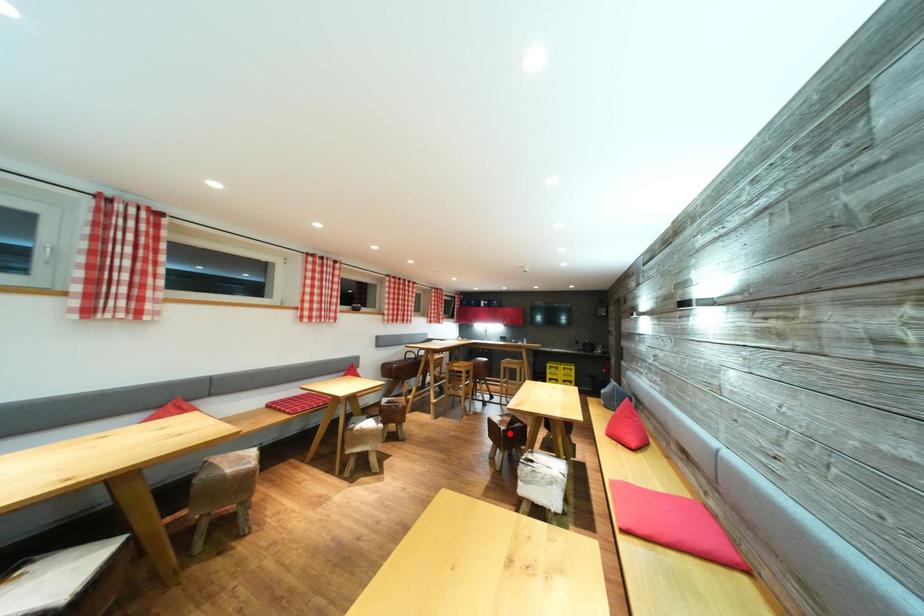
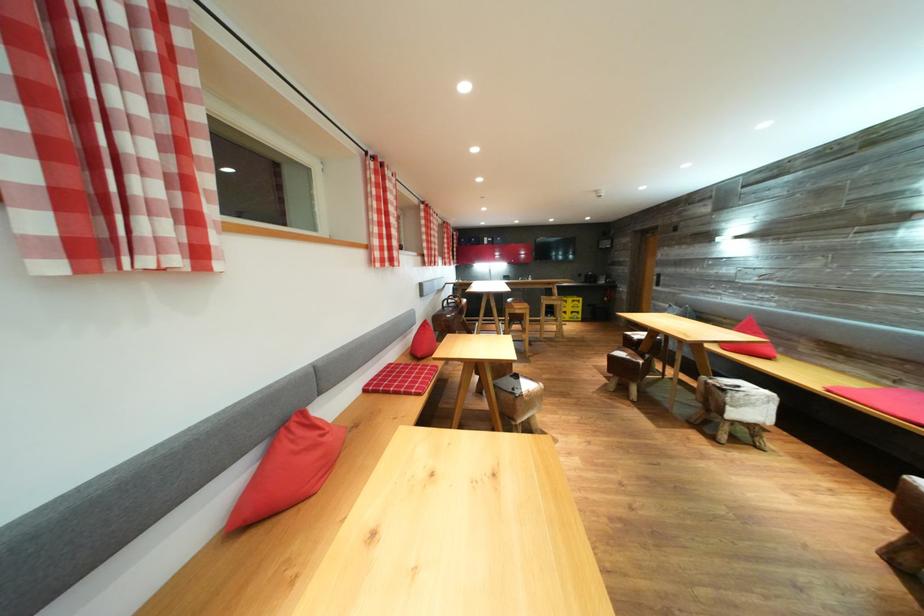
Question: I am providing you with two images of the same scene from different viewpoints. Given a red point in image1, look at the same physical point in image2. Is it:

Choices:
 (A) Closer to the viewpoint
 (B) Farther from the viewpoint

Answer: (B)